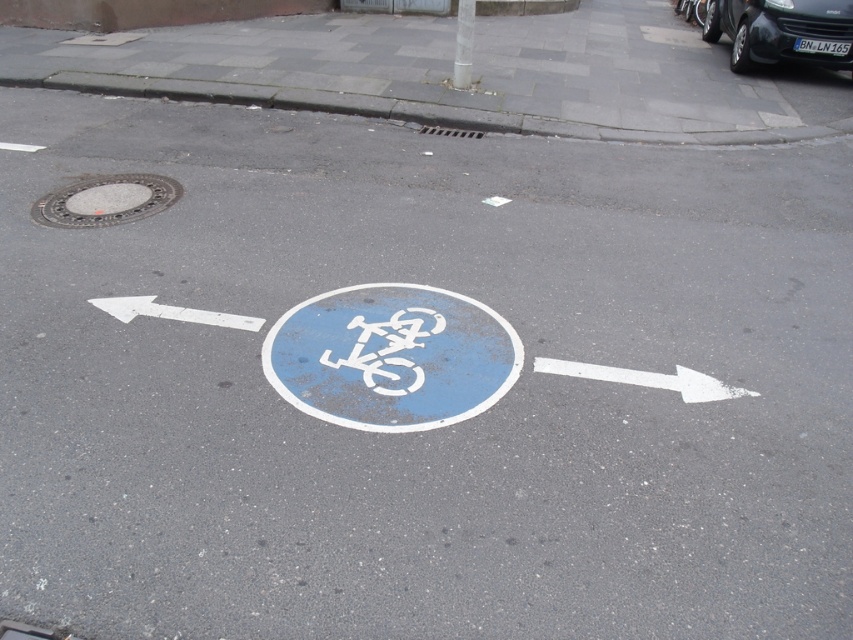
Between white matte bicycle symbol at center and white painted arrow at left, which one appears on the right side from the viewer's perspective?

white matte bicycle symbol at center is more to the right.

Can you confirm if white matte bicycle symbol at center is thinner than white painted arrow at left?

Correct, white matte bicycle symbol at center's width is less than white painted arrow at left's.

The image size is (853, 640). Describe the element at coordinates (387, 349) in the screenshot. I see `white matte bicycle symbol at center` at that location.

What are the coordinates of `white matte bicycle symbol at center` in the screenshot? It's located at (387, 349).

Does black metallic car at upper right have a greater height compared to metallic pole at upper center?

Correct, black metallic car at upper right is much taller as metallic pole at upper center.

Based on the photo, does black metallic car at upper right appear on the right side of metallic pole at upper center?

Yes, black metallic car at upper right is to the right of metallic pole at upper center.

Between point (825, 26) and point (460, 42), which one is positioned behind?

The point (825, 26) is behind.

The width and height of the screenshot is (853, 640). I want to click on black metallic car at upper right, so click(x=782, y=32).

This screenshot has width=853, height=640. Describe the element at coordinates (392, 356) in the screenshot. I see `blue painted bicycle sign at center` at that location.

You are a GUI agent. You are given a task and a screenshot of the screen. Output one action in this format:
    pyautogui.click(x=<x>, y=<y>)
    Task: Click on the blue painted bicycle sign at center
    
    Given the screenshot: What is the action you would take?
    pyautogui.click(x=392, y=356)

Does point (471, 410) come closer to viewer compared to point (457, 84)?

Yes, point (471, 410) is closer to viewer.

Locate an element on the screen. The width and height of the screenshot is (853, 640). blue painted bicycle sign at center is located at coordinates (392, 356).